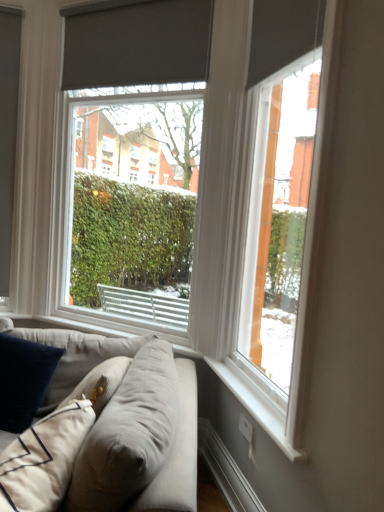
Question: Does matte gray roller blind at center, the 2th window viewed from the front, lie in front of light gray fabric couch at lower left?

Choices:
 (A) yes
 (B) no

Answer: (B)

Question: Does matte gray roller blind at center, the 2th window viewed from the right, appear on the right side of light gray fabric couch at lower left?

Choices:
 (A) no
 (B) yes

Answer: (B)

Question: Considering the relative sizes of matte gray roller blind at center, the first window from the back, and light gray fabric couch at lower left in the image provided, is matte gray roller blind at center, the first window from the back, thinner than light gray fabric couch at lower left?

Choices:
 (A) yes
 (B) no

Answer: (A)

Question: Is matte gray roller blind at center, the first window from the back, surrounding light gray fabric couch at lower left?

Choices:
 (A) no
 (B) yes

Answer: (A)

Question: Is matte gray roller blind at center, which is the 1th window in left-to-right order, next to light gray fabric couch at lower left?

Choices:
 (A) no
 (B) yes

Answer: (A)

Question: From the image's perspective, is white painted wood at lower right located above or below light gray fabric couch at lower left?

Choices:
 (A) below
 (B) above

Answer: (B)

Question: From a real-world perspective, is white painted wood at lower right positioned above or below light gray fabric couch at lower left?

Choices:
 (A) below
 (B) above

Answer: (B)

Question: Would you say white painted wood at lower right is to the left or to the right of light gray fabric couch at lower left in the picture?

Choices:
 (A) right
 (B) left

Answer: (A)

Question: Which is correct: white painted wood at lower right is inside light gray fabric couch at lower left, or outside of it?

Choices:
 (A) outside
 (B) inside

Answer: (A)

Question: From a real-world perspective, is velvety dark blue pillow at lower left physically located above or below matte gray roller blind at right, the 2th window viewed from the left?

Choices:
 (A) above
 (B) below

Answer: (B)

Question: In the image, is velvety dark blue pillow at lower left positioned in front of or behind matte gray roller blind at right, marked as the 1th window in a front-to-back arrangement?

Choices:
 (A) front
 (B) behind

Answer: (B)

Question: In terms of width, does velvety dark blue pillow at lower left look wider or thinner when compared to matte gray roller blind at right, marked as the first window in a right-to-left arrangement?

Choices:
 (A) wide
 (B) thin

Answer: (A)

Question: Looking at the image, does velvety dark blue pillow at lower left seem bigger or smaller compared to matte gray roller blind at right, the 2th window viewed from the left?

Choices:
 (A) small
 (B) big

Answer: (A)

Question: Looking at the image, does velvety dark blue pillow at lower left seem bigger or smaller compared to matte gray roller blind at center, the 2th window viewed from the right?

Choices:
 (A) small
 (B) big

Answer: (A)

Question: Considering the positions of velvety dark blue pillow at lower left and matte gray roller blind at center, the 2th window viewed from the front, in the image, is velvety dark blue pillow at lower left wider or thinner than matte gray roller blind at center, the 2th window viewed from the front,?

Choices:
 (A) thin
 (B) wide

Answer: (B)